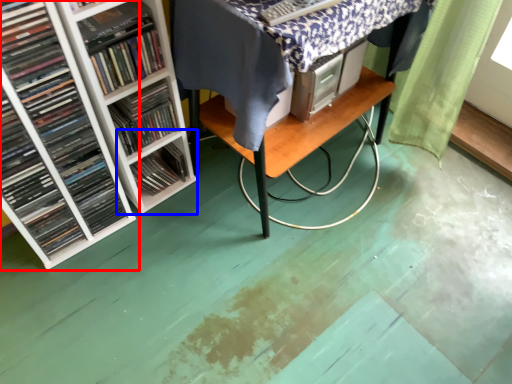
Question: Which object is further to the camera taking this photo, book (highlighted by a red box) or shelf (highlighted by a blue box)?

Choices:
 (A) book
 (B) shelf

Answer: (B)